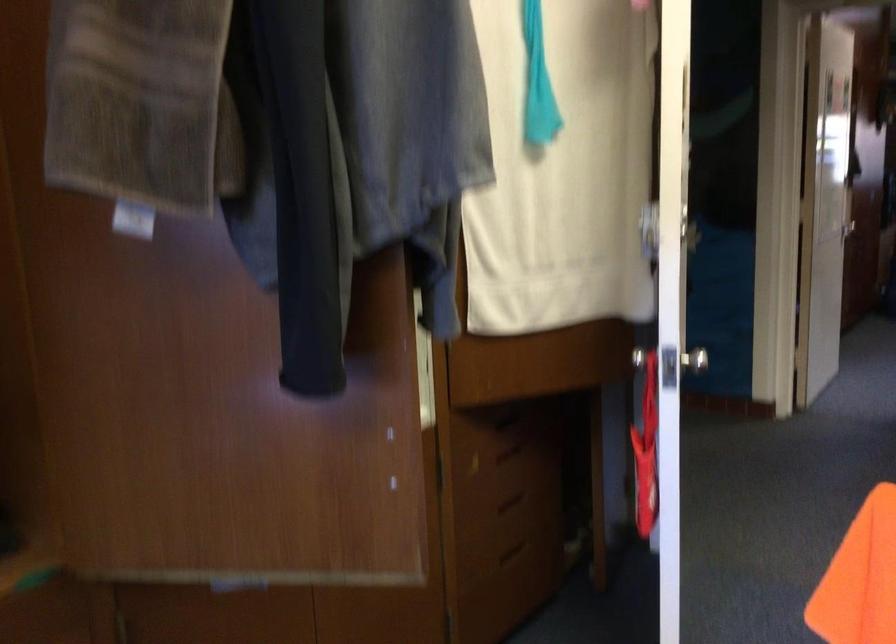
This screenshot has width=896, height=644. Describe the element at coordinates (694, 360) in the screenshot. I see `the silver door handle` at that location.